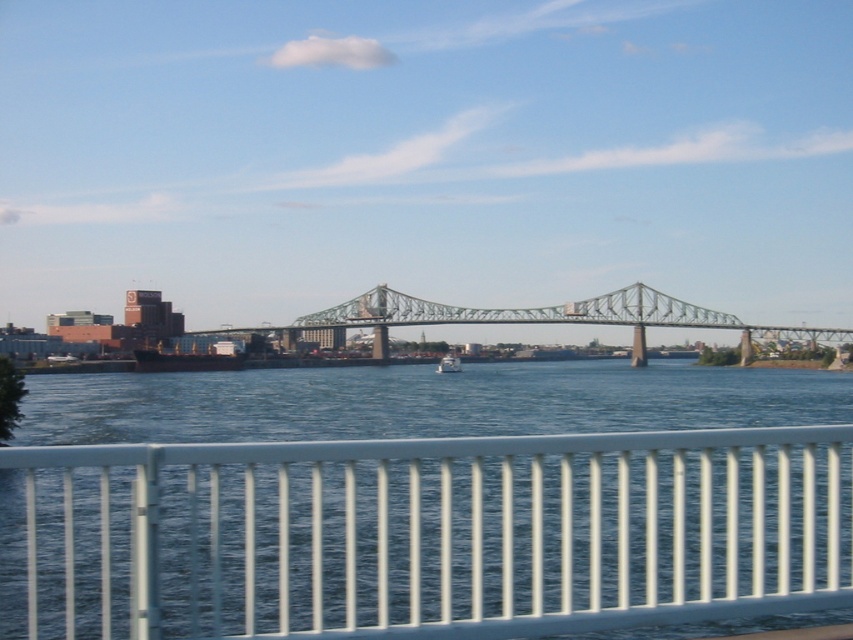
Question: Among these points, which one is nearest to the camera?

Choices:
 (A) (672, 301)
 (B) (451, 362)

Answer: (B)

Question: Can you confirm if white metal railing at lower center is positioned above white glossy boat at center?

Choices:
 (A) yes
 (B) no

Answer: (A)

Question: Which is farther from the green metallic bridge at center?

Choices:
 (A) white glossy boat at center
 (B) white metal railing at lower center

Answer: (B)

Question: Does white metal railing at lower center have a larger size compared to white glossy boat at center?

Choices:
 (A) yes
 (B) no

Answer: (A)

Question: In this image, where is green metallic bridge at center located relative to white glossy boat at center?

Choices:
 (A) left
 (B) right

Answer: (B)

Question: Which point is closer to the camera taking this photo?

Choices:
 (A) tap(567, 509)
 (B) tap(515, 310)

Answer: (A)